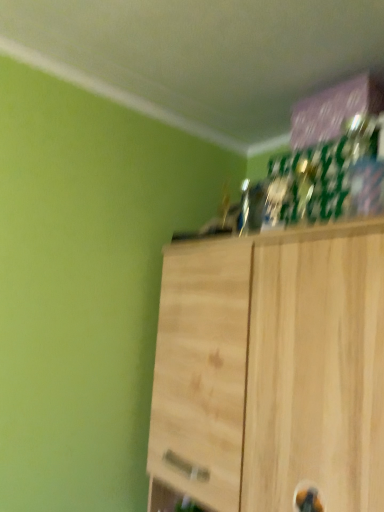
At what (x,y) coordinates should I click in order to perform the action: click on natural wood cabinet at upper right. Please return your answer as a coordinate pair (x, y). This screenshot has height=512, width=384. Looking at the image, I should click on (272, 369).

Measure the distance between natural wood cabinet at upper right and camera.

natural wood cabinet at upper right and camera are 75.55 centimeters apart.

Image resolution: width=384 pixels, height=512 pixels. Describe the element at coordinates (272, 369) in the screenshot. I see `natural wood cabinet at upper right` at that location.

Where is `natural wood cabinet at upper right`? This screenshot has height=512, width=384. natural wood cabinet at upper right is located at coordinates (272, 369).